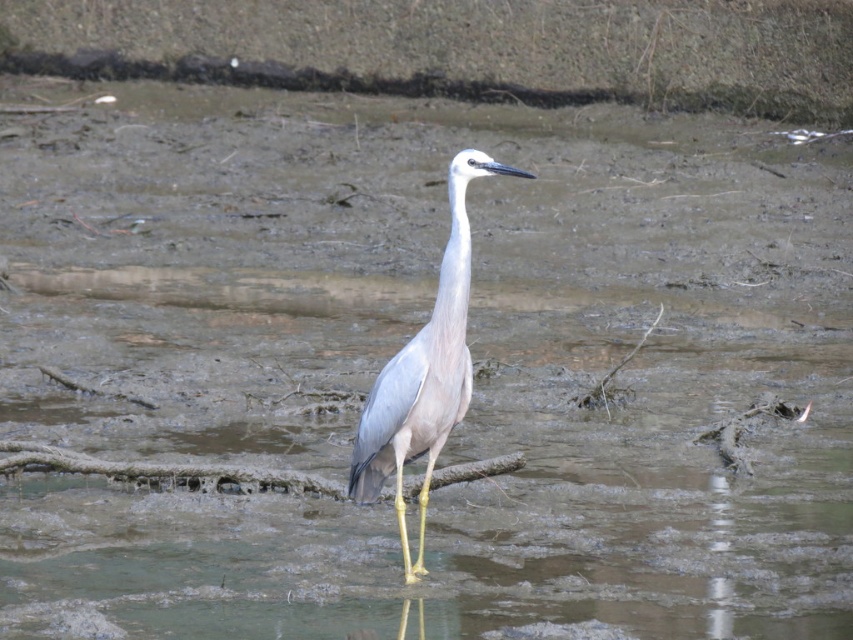
Question: Can you confirm if white matte bird at center is positioned above white smooth neck at center?

Choices:
 (A) no
 (B) yes

Answer: (A)

Question: Which object is closer to the camera taking this photo?

Choices:
 (A) white smooth neck at center
 (B) white matte bird at center

Answer: (B)

Question: Does white matte bird at center have a greater width compared to white smooth neck at center?

Choices:
 (A) no
 (B) yes

Answer: (B)

Question: Which point is closer to the camera?

Choices:
 (A) white smooth neck at center
 (B) white matte bird at center

Answer: (B)

Question: Does white matte bird at center have a larger size compared to white smooth neck at center?

Choices:
 (A) yes
 (B) no

Answer: (A)